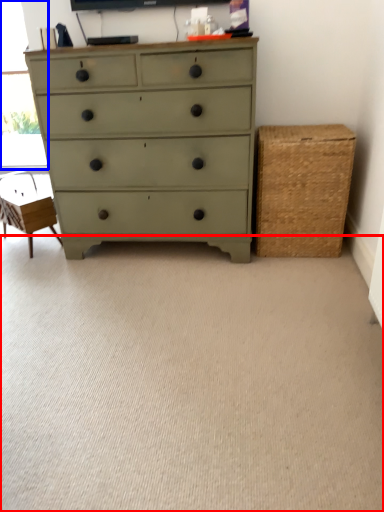
Question: Which point is further to the camera, plain (highlighted by a red box) or window screen (highlighted by a blue box)?

Choices:
 (A) plain
 (B) window screen

Answer: (B)